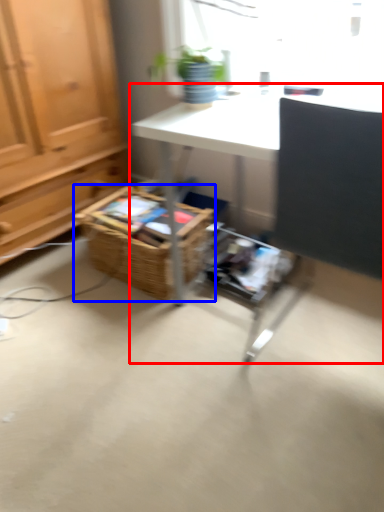
Question: Which point is further to the camera, desk (highlighted by a red box) or basket (highlighted by a blue box)?

Choices:
 (A) desk
 (B) basket

Answer: (B)